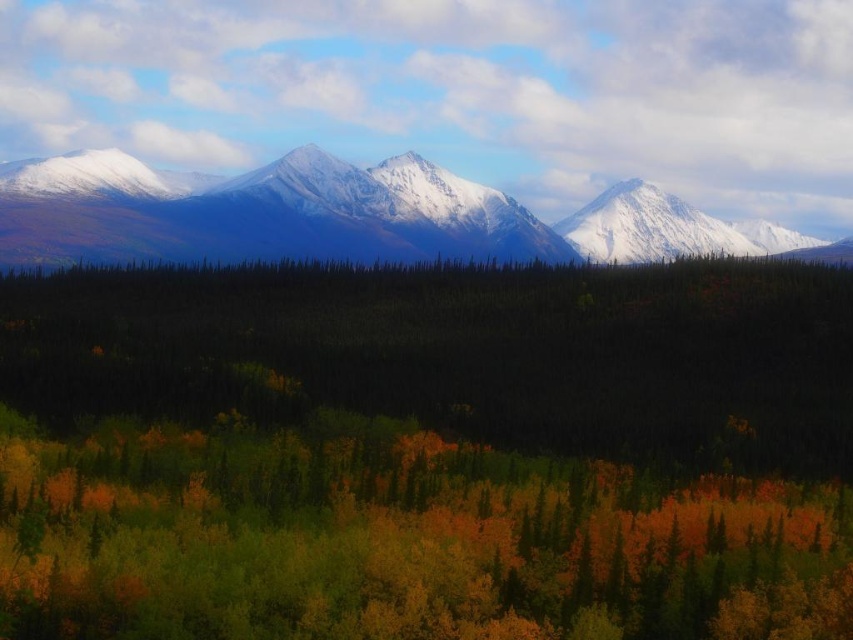
Question: Can you confirm if green matte forest at center is positioned to the right of snowy granite mountains at upper center?

Choices:
 (A) no
 (B) yes

Answer: (A)

Question: Can you confirm if green matte forest at center is smaller than snowy granite mountains at upper center?

Choices:
 (A) no
 (B) yes

Answer: (B)

Question: In this image, where is green matte forest at center located relative to snowy granite mountains at upper center?

Choices:
 (A) left
 (B) right

Answer: (A)

Question: Which of the following is the closest to the observer?

Choices:
 (A) green matte forest at center
 (B) snowy granite mountains at upper center

Answer: (A)